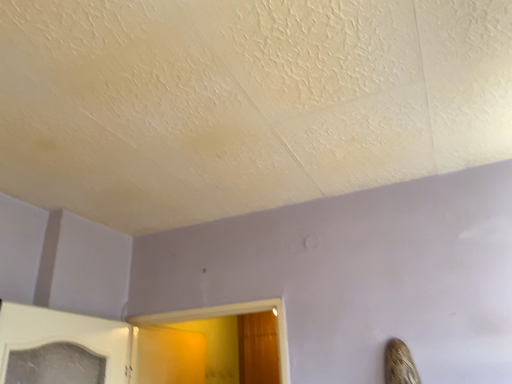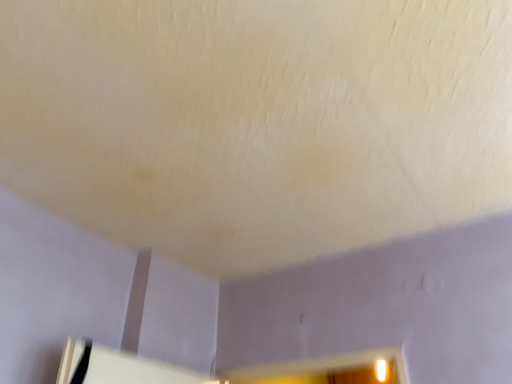
Question: How did the camera likely rotate when shooting the video?

Choices:
 (A) rotated left
 (B) rotated right

Answer: (A)